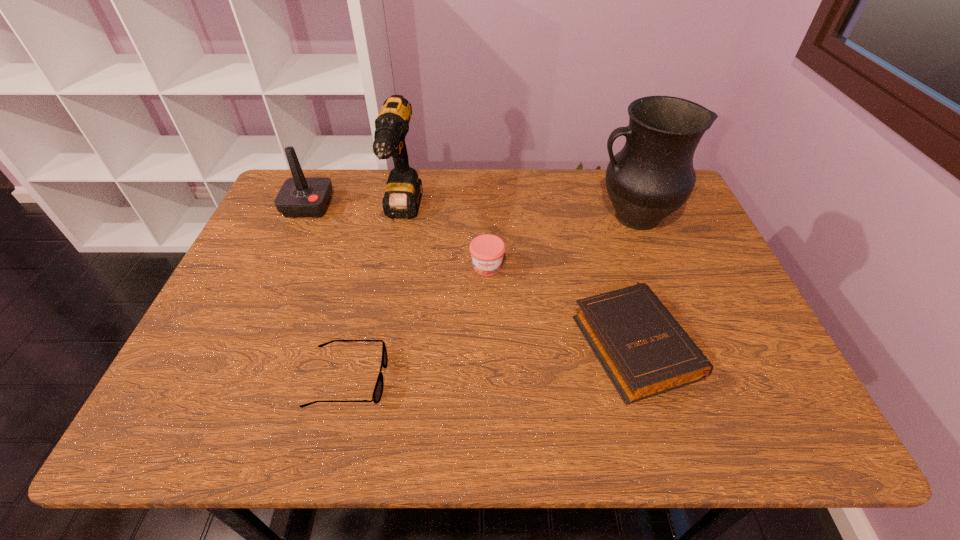
Locate an element on the screen. spectacles positioned at the near edge is located at coordinates (378, 390).

Find the location of a particular element. This screenshot has height=540, width=960. object located in the left edge section of the desktop is located at coordinates (299, 197).

The width and height of the screenshot is (960, 540). What are the coordinates of `pitcher at the right edge` in the screenshot? It's located at (652, 176).

Identify the location of Bible present at the right edge. (645, 352).

Locate an element on the screen. object located at the far left corner is located at coordinates [x=299, y=197].

Identify the location of object at the far right corner. (652, 176).

The width and height of the screenshot is (960, 540). In order to click on object that is at the near right corner in this screenshot , I will do `click(645, 352)`.

Image resolution: width=960 pixels, height=540 pixels. In the image, there is a desktop. In order to click on vacant space at the far edge in this screenshot , I will do `click(348, 200)`.

Image resolution: width=960 pixels, height=540 pixels. What are the coordinates of `vacant region at the near edge of the desktop` in the screenshot? It's located at (649, 404).

In the image, there is a desktop. Where is `free region at the right edge`? This screenshot has height=540, width=960. free region at the right edge is located at coordinates (715, 281).